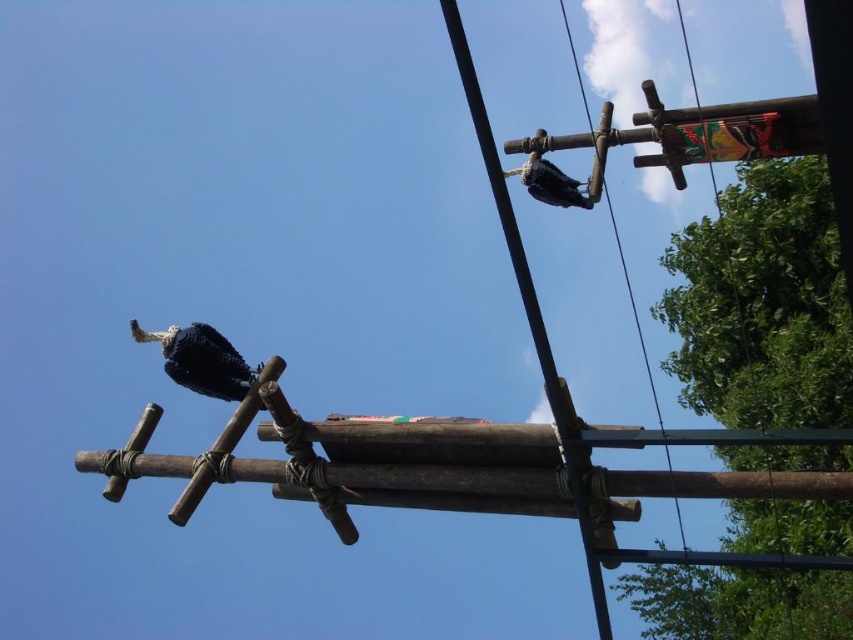
You are a photographer standing at the camera position. You want to capture a closeup shot of the blue speckled feathers at left. The maximum distance your camera can focus is 70 feet. Can you take the photo without moving closer?

The blue speckled feathers at left and camera are 79.69 feet apart, which exceeds the camera maximum focus distance of 70 feet. Therefore, you cannot take the photo without moving closer.

You are an ornithologist observing the wooden structure. You notice the blue speckled feathers at left and the blue glossy woodpecker at upper center. Which of these has a smaller height?

The blue speckled feathers at left has a lesser height compared to the blue glossy woodpecker at upper center.

You are an ornithologist observing a bird habitat. You notice the blue speckled feathers at left and the blue glossy woodpecker at upper center. Which of these two has a larger size?

The blue speckled feathers at left is bigger than the blue glossy woodpecker at upper center.